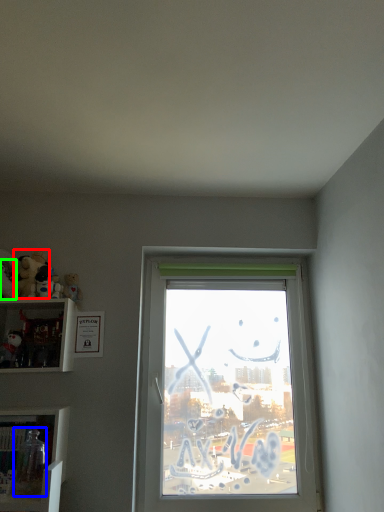
Question: Considering the real-world distances, which object is farthest from toy (highlighted by a red box)? toy (highlighted by a blue box) or toy (highlighted by a green box)?

Choices:
 (A) toy
 (B) toy

Answer: (A)